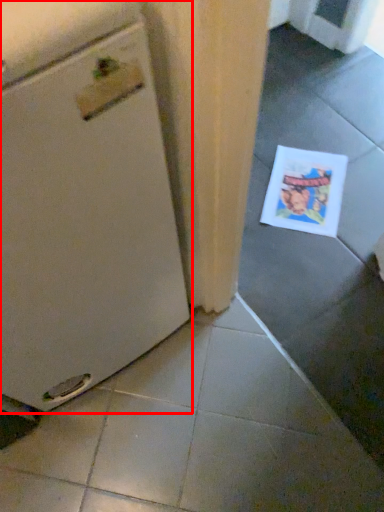
Question: In this image, where is home appliance (annotated by the red box) located relative to comic book?

Choices:
 (A) left
 (B) right

Answer: (A)